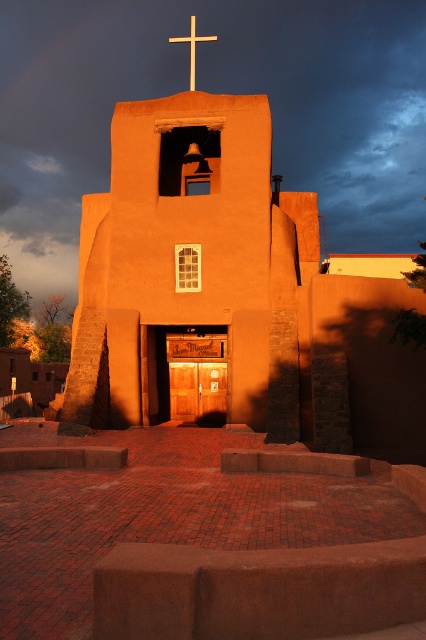
You are standing 100 feet away from the church and want to reach the point marked at coordinates point (x=307, y=419). Can you walk directly to it without moving closer than 50 feet to the church?

The distance of point (x=307, y=419) from viewer is 56.71 feet. Since you are currently 100 feet away, moving to the point would bring you to 56.71 feet, which is within the 50 feet limit. Therefore, you would be too close to the church.

You are standing in front of the adobe stucco chapel at center and want to take a photo of the wooden cross at upper center. Since the chapel is between you and the cross, will the chapel block your view of the cross?

The adobe stucco chapel at center is closer to the viewer than the wooden cross at upper center, so the chapel will block your view of the cross.

You are standing in front of the adobe stucco chapel at center and want to place a flower bouquet at the base of the wooden cross at upper center. Can you reach the cross from your current position without climbing the building?

The adobe stucco chapel at center is positioned under the wooden cross at upper center, meaning the cross is above and likely out of reach from the ground. You would need a ladder or some form of elevation to place the bouquet at the base of the cross.